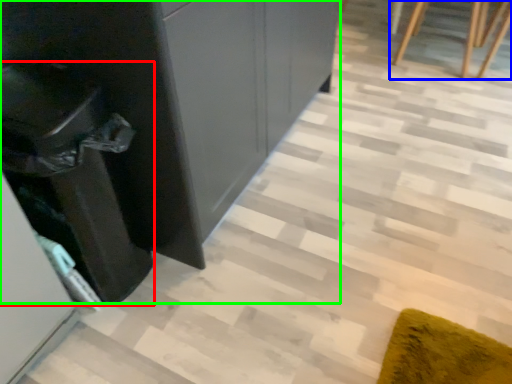
Question: Which object is positioned farthest from cabinetry (highlighted by a red box)? Select from furniture (highlighted by a blue box) and dresser (highlighted by a green box).

Choices:
 (A) furniture
 (B) dresser

Answer: (A)